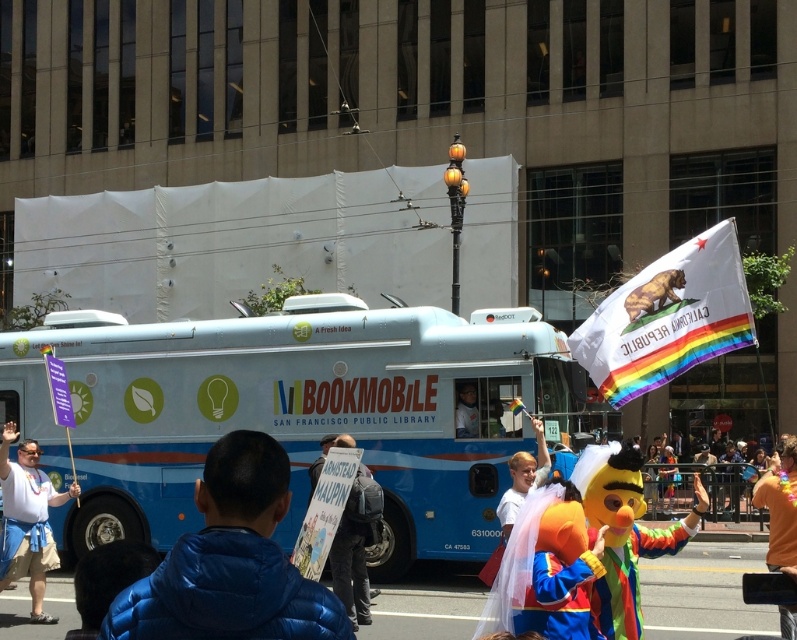
Between rainbow fabric sesame street character at center and blue fabric shirt at left, which one has less height?

Standing shorter between the two is rainbow fabric sesame street character at center.

Which is behind, point (599, 486) or point (26, 508)?

Point (26, 508)

The width and height of the screenshot is (797, 640). What are the coordinates of `rainbow fabric sesame street character at center` in the screenshot? It's located at (623, 532).

Can you confirm if blue puffer jacket at lower center is shorter than matte white bus at center?

Yes.

Locate an element on the screen. blue puffer jacket at lower center is located at coordinates (230, 563).

You are a GUI agent. You are given a task and a screenshot of the screen. Output one action in this format:
    pyautogui.click(x=<x>, y=<y>)
    Task: Click on the blue puffer jacket at lower center
    The width and height of the screenshot is (797, 640).
    Given the screenshot: What is the action you would take?
    pyautogui.click(x=230, y=563)

Is the position of blue puffer jacket at lower center more distant than that of rainbow fabric sesame street character at center?

No, blue puffer jacket at lower center is in front of rainbow fabric sesame street character at center.

In order to click on blue puffer jacket at lower center in this screenshot , I will do `click(230, 563)`.

Is point (224, 440) in front of point (695, 516)?

Yes, it is.

In order to click on blue puffer jacket at lower center in this screenshot , I will do `click(230, 563)`.